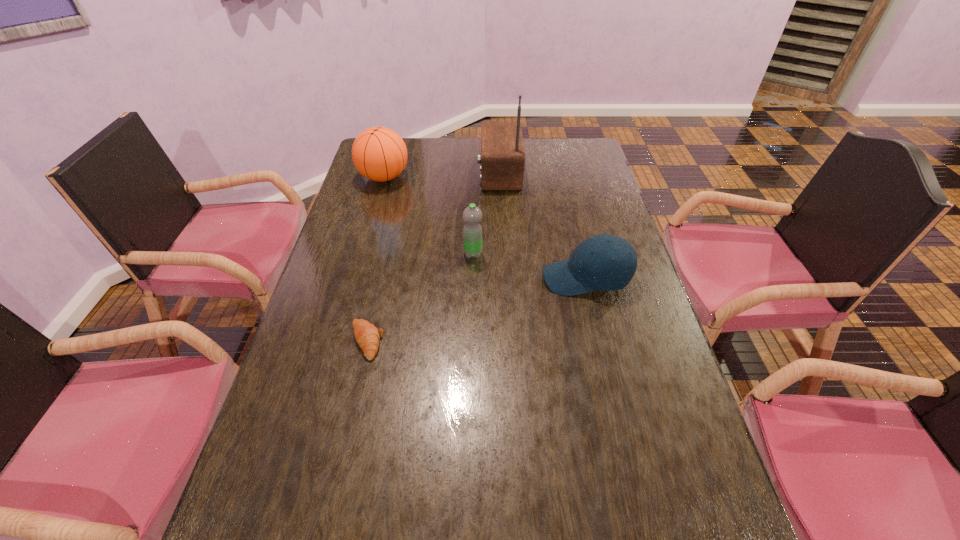
The image size is (960, 540). I want to click on free region located 0.150m on the back of the basketball, so click(394, 144).

You are a GUI agent. You are given a task and a screenshot of the screen. Output one action in this format:
    pyautogui.click(x=<x>, y=<y>)
    Task: Click on the vacant space located on the back of the third nearest object
    Image resolution: width=960 pixels, height=540 pixels.
    Given the screenshot: What is the action you would take?
    pyautogui.click(x=473, y=225)

This screenshot has width=960, height=540. Find the location of `vacant space located 0.260m on the front-facing side of the fourth farthest object`. vacant space located 0.260m on the front-facing side of the fourth farthest object is located at coordinates (450, 279).

At what (x,y) coordinates should I click in order to perform the action: click on vacant region located 0.370m on the front-facing side of the fourth farthest object. Please return your answer as a coordinate pair (x, y). Looking at the image, I should click on 411,279.

Where is `free spot located on the front-facing side of the fourth farthest object`? free spot located on the front-facing side of the fourth farthest object is located at coordinates (461, 279).

Locate an element on the screen. vacant space located 0.180m on the right of the crescent roll is located at coordinates (456, 341).

The image size is (960, 540). What are the coordinates of `radio receiver at the far edge` in the screenshot? It's located at (502, 158).

Where is `basketball located in the far edge section of the desktop`? basketball located in the far edge section of the desktop is located at coordinates (379, 154).

You are a GUI agent. You are given a task and a screenshot of the screen. Output one action in this format:
    pyautogui.click(x=<x>, y=<y>)
    Task: Click on the basketball at the left edge
    
    Given the screenshot: What is the action you would take?
    pyautogui.click(x=379, y=154)

This screenshot has width=960, height=540. What are the coordinates of `crescent roll situated at the left edge` in the screenshot? It's located at pos(367,335).